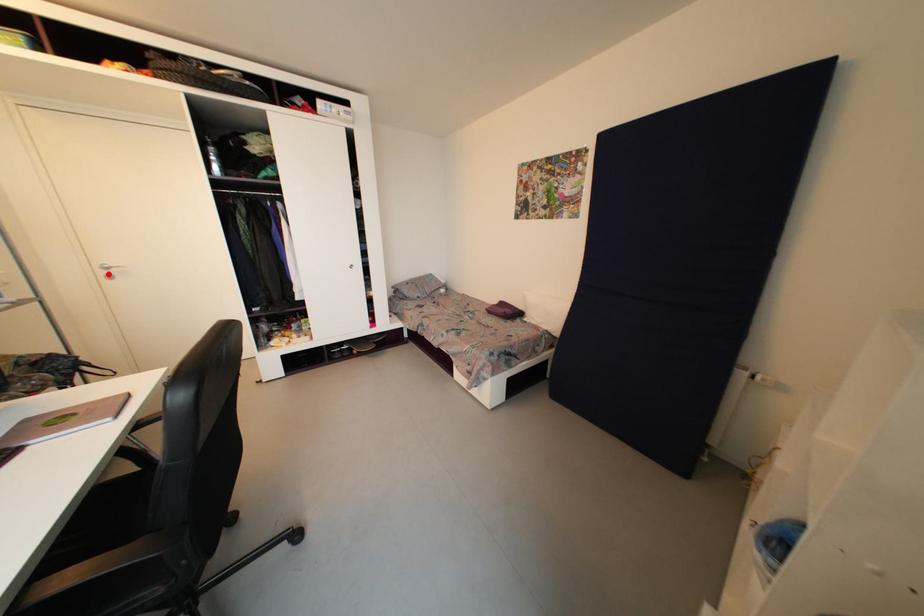
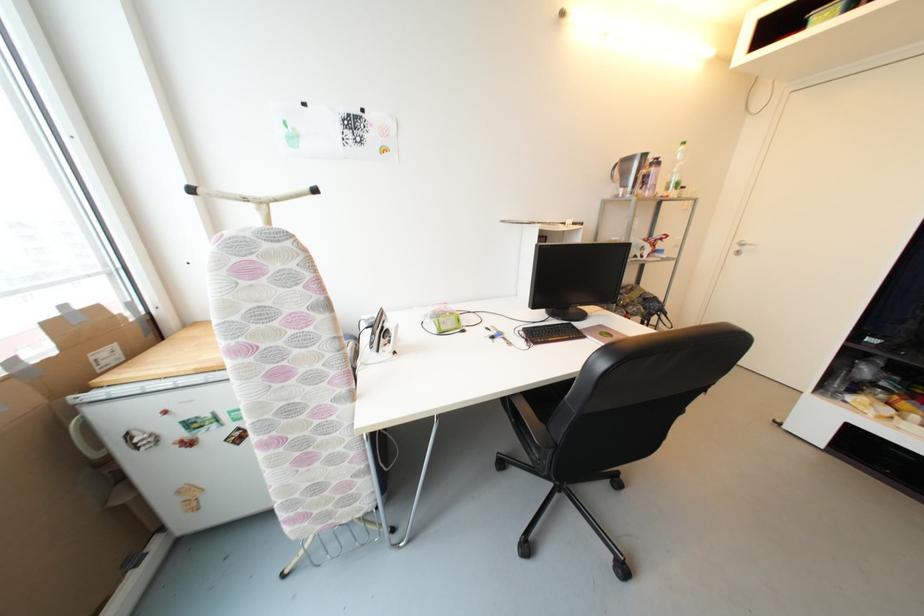
Locate, in the second image, the point that corresponds to the highlighted location in the first image.

(742, 249)